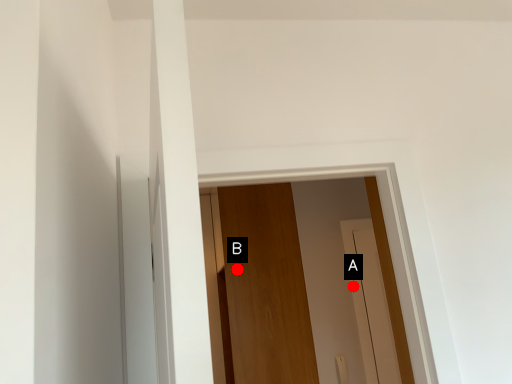
Question: Two points are circled on the image, labeled by A and B beside each circle. Which of the following is the farthest from the observer?

Choices:
 (A) A is further
 (B) B is further

Answer: (A)